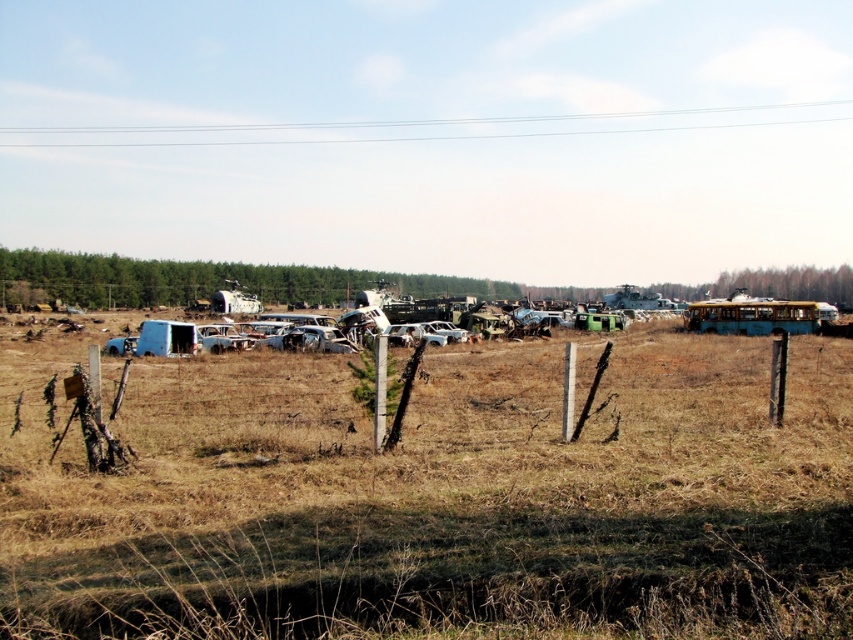
Question: Estimate the real-world distances between objects in this image. Which object is closer to the brown dry grass at center?

Choices:
 (A) silver metallic car at center
 (B) blue matte bus at right

Answer: (A)

Question: Does brown dry grass at center appear over silver metallic car at center?

Choices:
 (A) no
 (B) yes

Answer: (A)

Question: Is blue matte bus at right to the left of silver metallic car at center from the viewer's perspective?

Choices:
 (A) no
 (B) yes

Answer: (A)

Question: Is blue matte bus at right in front of silver metallic car at center?

Choices:
 (A) no
 (B) yes

Answer: (A)

Question: Which object is positioned closest to the silver metallic car at center?

Choices:
 (A) brown dry grass at center
 (B) blue matte bus at right

Answer: (A)

Question: Which point is farther from the camera taking this photo?

Choices:
 (A) (611, 570)
 (B) (801, 326)

Answer: (B)